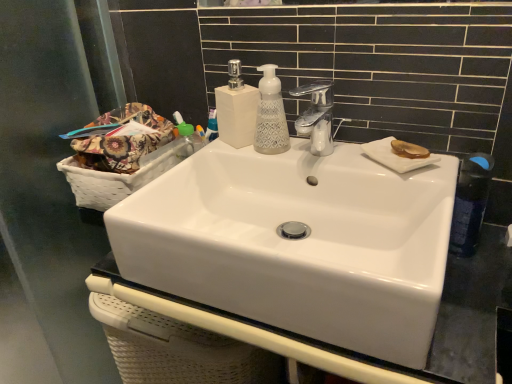
Locate an element on the screen. The width and height of the screenshot is (512, 384). free space on the front side of white matte soap dispenser at center, which is the second soap dispenser from right to left is located at coordinates (223, 160).